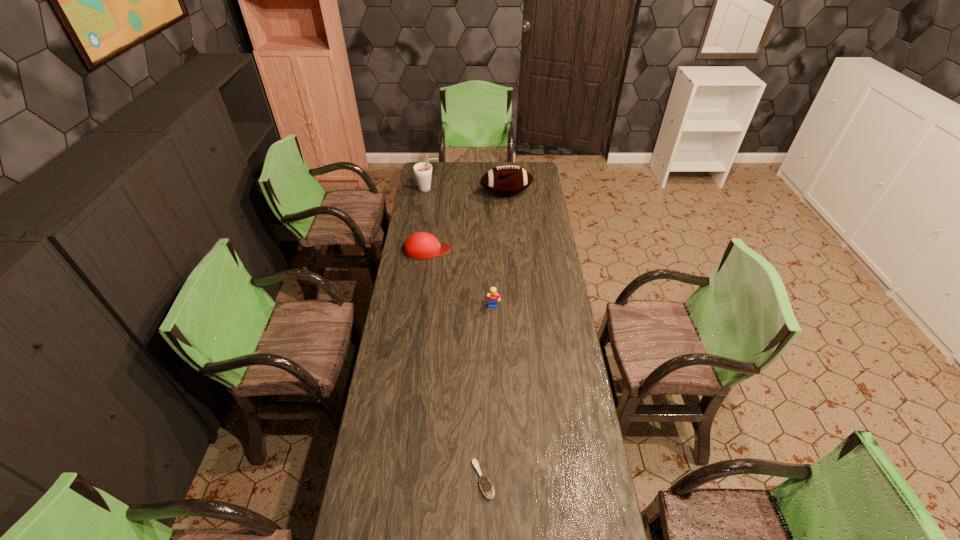
The height and width of the screenshot is (540, 960). In order to click on free location located 0.370m on the front-facing side of the third nearest object in this screenshot , I will do `click(526, 249)`.

Where is `vacant space located 0.050m on the back of the shortest object`? The image size is (960, 540). vacant space located 0.050m on the back of the shortest object is located at coordinates (483, 444).

The image size is (960, 540). Find the location of `root beer present at the left edge`. root beer present at the left edge is located at coordinates (423, 171).

Image resolution: width=960 pixels, height=540 pixels. What are the coordinates of `baseball cap present at the left edge` in the screenshot? It's located at (420, 245).

Where is `object located at the right edge`? Image resolution: width=960 pixels, height=540 pixels. object located at the right edge is located at coordinates (506, 180).

This screenshot has height=540, width=960. Find the location of `free space at the left edge of the desktop`. free space at the left edge of the desktop is located at coordinates (399, 387).

Locate an element on the screen. The image size is (960, 540). free region at the right edge is located at coordinates (531, 211).

The width and height of the screenshot is (960, 540). Identify the location of vacant space that's between the root beer and the football (American). (467, 192).

Locate an element on the screen. This screenshot has height=540, width=960. free space between the root beer and the third nearest object is located at coordinates (428, 220).

Find the location of a particular element. The width and height of the screenshot is (960, 540). empty location between the fourth tallest object and the football (American) is located at coordinates tap(468, 222).